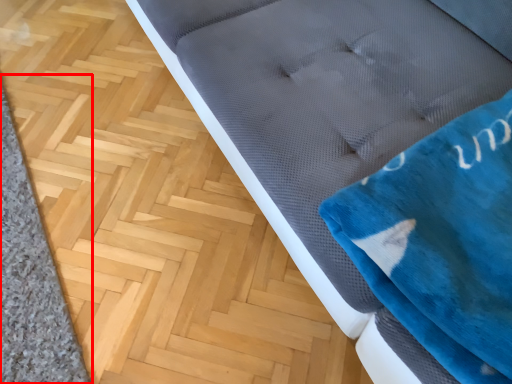
Question: In this image, where is doormat (annotated by the red box) located relative to cloth?

Choices:
 (A) right
 (B) left

Answer: (B)